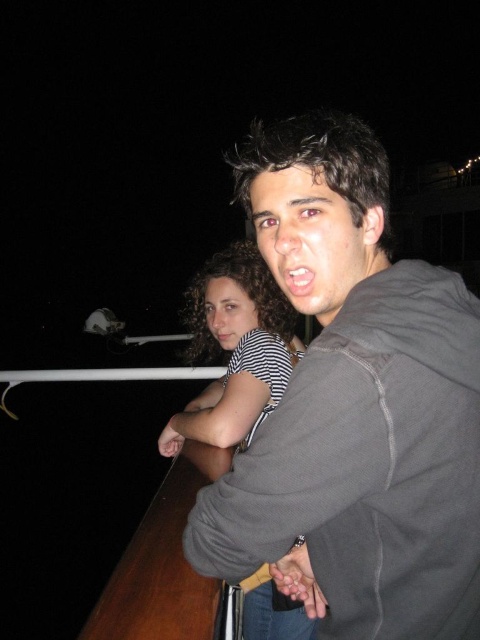
Question: Is dark gray hoodie at center smaller than striped fabric shirt at upper center?

Choices:
 (A) no
 (B) yes

Answer: (B)

Question: Which object appears farthest from the camera in this image?

Choices:
 (A) striped fabric shirt at upper center
 (B) dark gray hoodie at center

Answer: (A)

Question: Does dark gray hoodie at center appear on the left side of striped fabric shirt at upper center?

Choices:
 (A) no
 (B) yes

Answer: (A)

Question: Does dark gray hoodie at center appear on the right side of striped fabric shirt at upper center?

Choices:
 (A) no
 (B) yes

Answer: (B)

Question: Which point is farther from the camera taking this photo?

Choices:
 (A) (456, 288)
 (B) (236, 433)

Answer: (B)